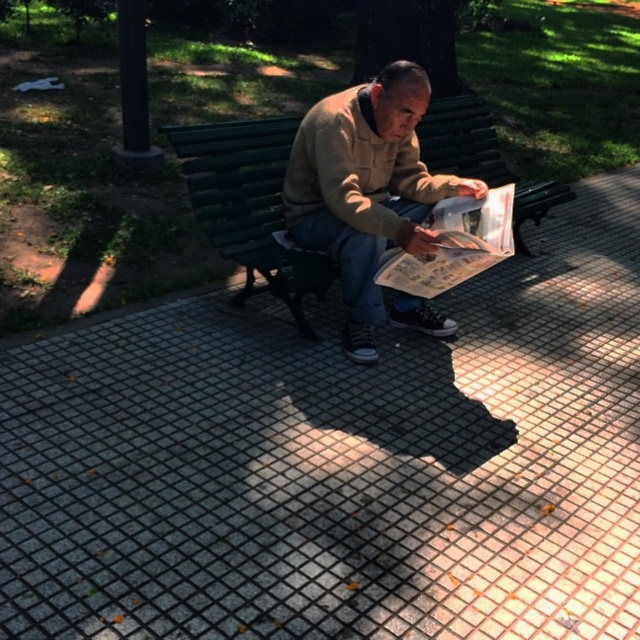
Question: Which point appears farthest from the camera in this image?

Choices:
 (A) (285, 284)
 (B) (376, 220)

Answer: (A)

Question: Considering the relative positions of light brown suede jacket at center and green wood bench at center in the image provided, where is light brown suede jacket at center located with respect to green wood bench at center?

Choices:
 (A) below
 (B) above

Answer: (B)

Question: Is light brown suede jacket at center to the right of green wood bench at center from the viewer's perspective?

Choices:
 (A) no
 (B) yes

Answer: (B)

Question: Which point is farther to the camera?

Choices:
 (A) light brown suede jacket at center
 (B) green wood bench at center

Answer: (B)

Question: Does light brown suede jacket at center have a smaller size compared to green wood bench at center?

Choices:
 (A) yes
 (B) no

Answer: (B)